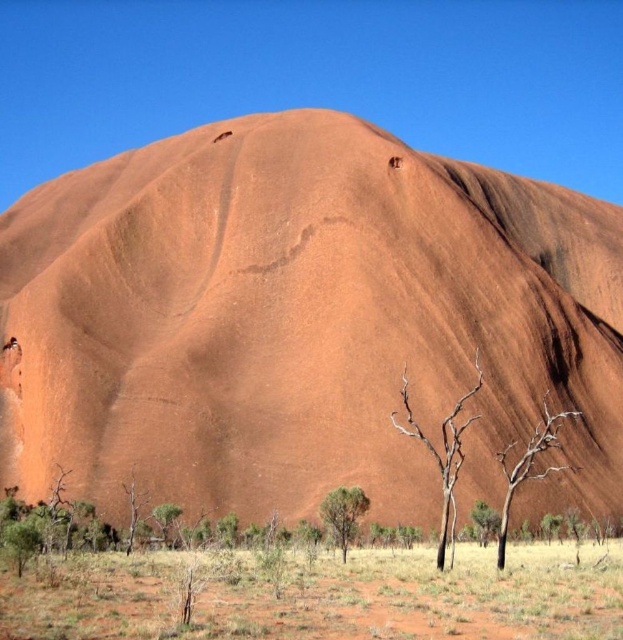
Does matte sandstone hill at center have a larger size compared to green leafy shrub at lower left?

Correct, matte sandstone hill at center is larger in size than green leafy shrub at lower left.

Does matte sandstone hill at center have a smaller size compared to green leafy shrub at lower left?

No, matte sandstone hill at center is not smaller than green leafy shrub at lower left.

Locate an element on the screen. matte sandstone hill at center is located at coordinates (305, 323).

Who is more distant from viewer, [335,492] or [166,524]?

Positioned behind is point [166,524].

Where is `green leafy tree at lower center`? green leafy tree at lower center is located at coordinates (343, 513).

Is green leafy shrub at lower center above green leafy shrub at lower left?

Yes.

The height and width of the screenshot is (640, 623). Find the location of `green leafy shrub at lower center`. green leafy shrub at lower center is located at coordinates (483, 522).